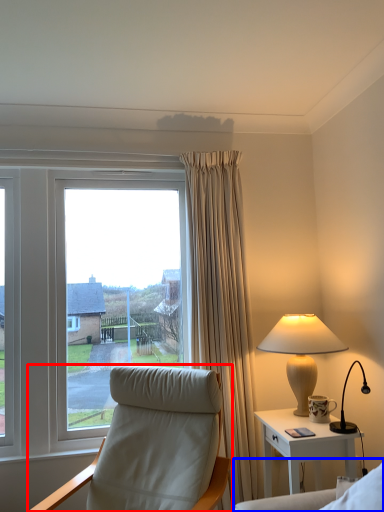
Question: Which object is closer to the camera taking this photo, chair (highlighted by a red box) or couch (highlighted by a blue box)?

Choices:
 (A) chair
 (B) couch

Answer: (B)